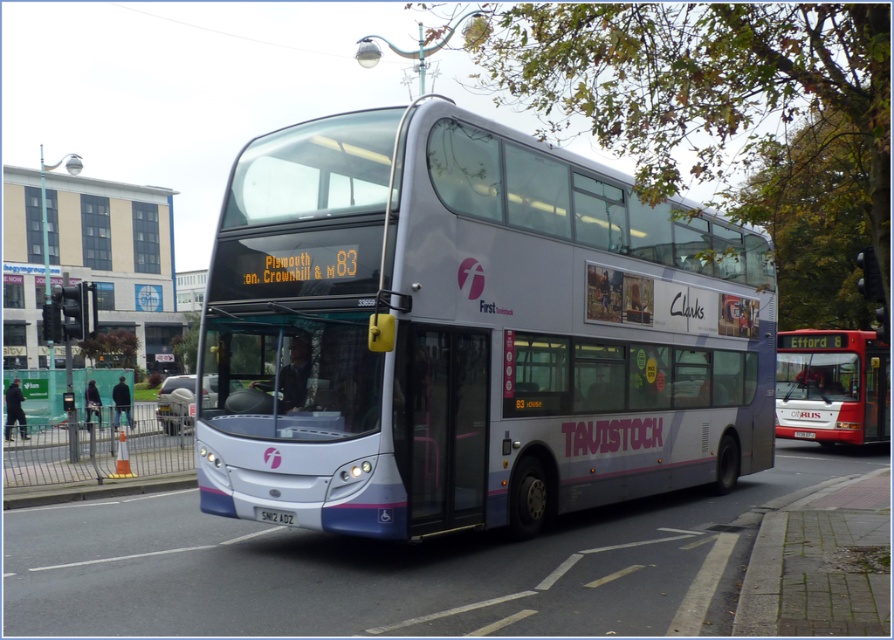
Question: Where is silver metallic bus at center located in relation to white plastic license plate at center in the image?

Choices:
 (A) above
 (B) below

Answer: (A)

Question: Which point is closer to the camera?

Choices:
 (A) (254, 509)
 (B) (874, 408)
 (C) (325, 269)

Answer: (C)

Question: Is red matte bus at center closer to the viewer compared to white plastic license plate at center?

Choices:
 (A) yes
 (B) no

Answer: (B)

Question: Which point is farther from the camera taking this photo?

Choices:
 (A) (831, 346)
 (B) (258, 516)
 (C) (478, 472)

Answer: (A)

Question: Considering the relative positions of red matte bus at center and white plastic license plate at center in the image provided, where is red matte bus at center located with respect to white plastic license plate at center?

Choices:
 (A) right
 (B) left

Answer: (A)

Question: Which of these objects is positioned closest to the silver metallic bus at center?

Choices:
 (A) white plastic license plate at center
 (B) red matte bus at center

Answer: (A)